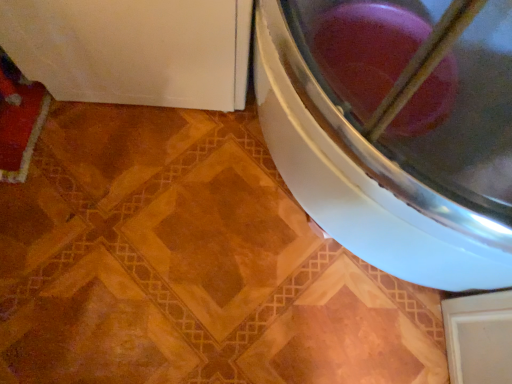
Question: From the image's perspective, is white glossy washing machine at lower right above or below white glossy washing machine at lower left?

Choices:
 (A) above
 (B) below

Answer: (B)

Question: Is white glossy washing machine at lower right in front of or behind white glossy washing machine at lower left in the image?

Choices:
 (A) front
 (B) behind

Answer: (A)

Question: From a real-world perspective, relative to white glossy washing machine at lower left, is white glossy washing machine at lower right vertically above or below?

Choices:
 (A) below
 (B) above

Answer: (B)

Question: From a real-world perspective, is white glossy washing machine at lower left physically located above or below white glossy washing machine at lower right?

Choices:
 (A) above
 (B) below

Answer: (B)

Question: Considering the positions of white glossy washing machine at lower left and white glossy washing machine at lower right in the image, is white glossy washing machine at lower left wider or thinner than white glossy washing machine at lower right?

Choices:
 (A) thin
 (B) wide

Answer: (A)

Question: Considering their positions, is white glossy washing machine at lower left located in front of or behind white glossy washing machine at lower right?

Choices:
 (A) behind
 (B) front

Answer: (A)

Question: Would you say white glossy washing machine at lower left is inside or outside white glossy washing machine at lower right?

Choices:
 (A) outside
 (B) inside

Answer: (A)